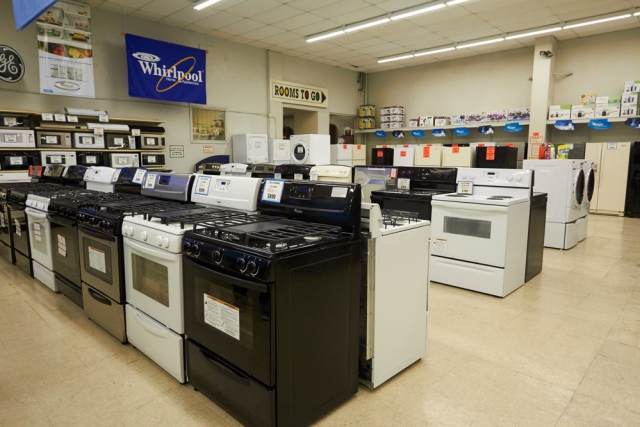
Locate an element on the screen. The image size is (640, 427). stoves for sale is located at coordinates (205, 226), (374, 222), (476, 196), (544, 200).